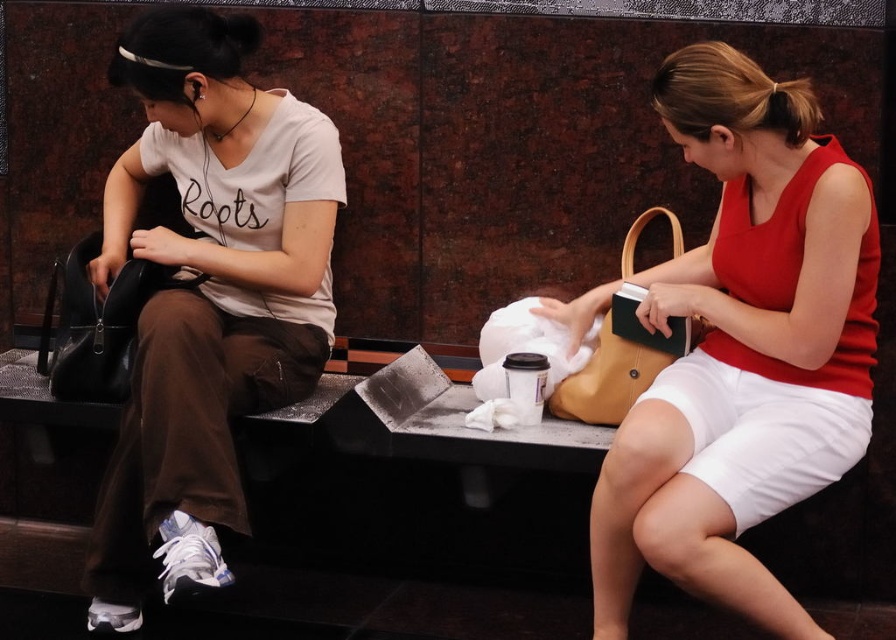
Question: Does matte yellow purse at right have a smaller size compared to black leather handbag at left?

Choices:
 (A) yes
 (B) no

Answer: (B)

Question: Is the position of black leather handbag at left less distant than that of matte brown handbag at right?

Choices:
 (A) no
 (B) yes

Answer: (A)

Question: Which point is closer to the camera taking this photo?

Choices:
 (A) (716, 280)
 (B) (239, 212)
 (C) (647, 216)

Answer: (A)

Question: Does matte black purse at left lie in front of black leather handbag at left?

Choices:
 (A) no
 (B) yes

Answer: (B)

Question: Which of the following is the farthest from the observer?

Choices:
 (A) (188, 218)
 (B) (602, 403)
 (C) (696, 536)
 (D) (126, 333)

Answer: (A)

Question: Which point is farther from the camera taking this photo?

Choices:
 (A) (128, 376)
 (B) (610, 339)

Answer: (B)